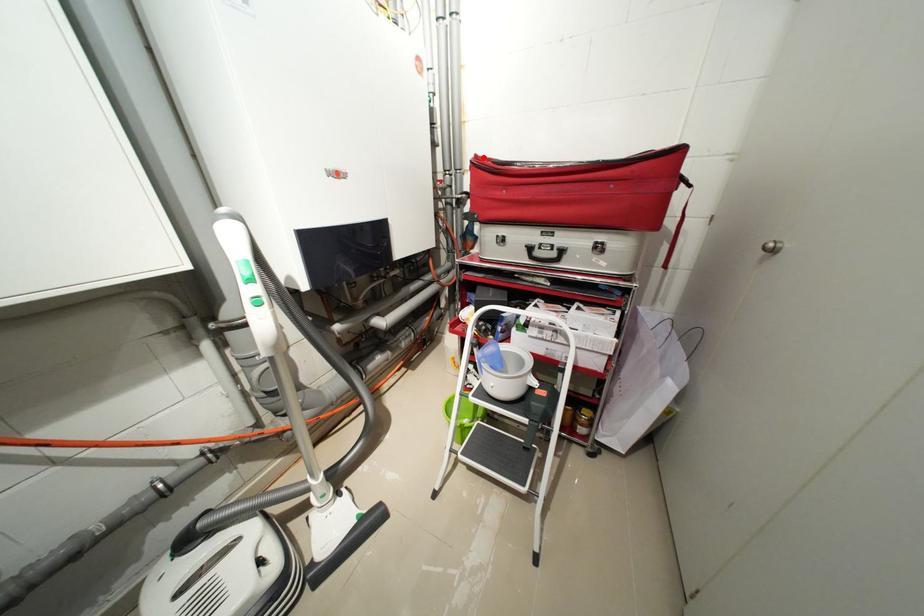
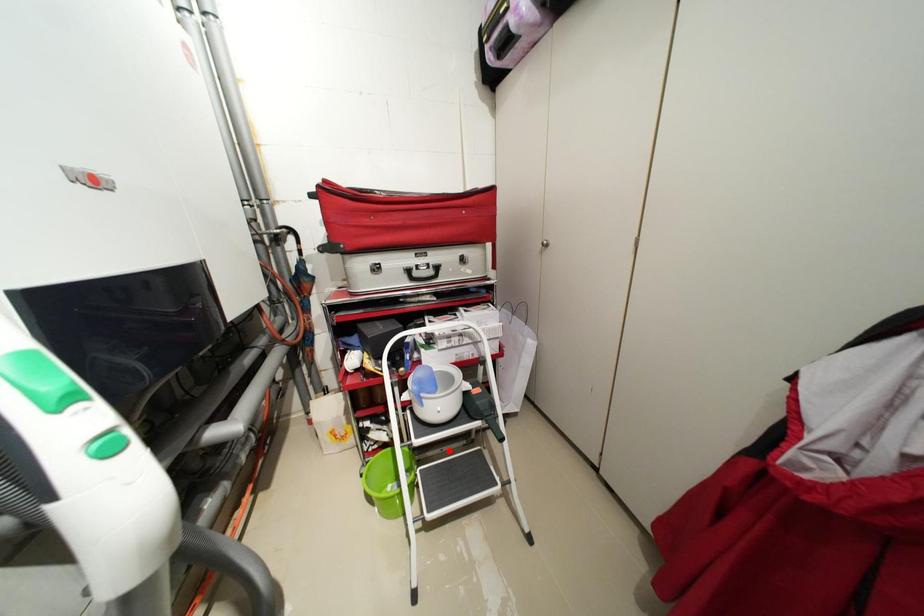
I am providing you with two images of the same scene from different viewpoints. A red point is marked on the first image and another point is marked on the second image. Is the marked point in image1 the same physical position as the marked point in image2?

No